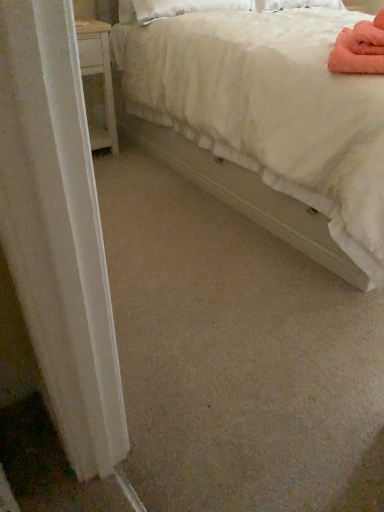
Question: From the image's perspective, is pink fluffy bath towel at upper right over white fluffy bed at upper right?

Choices:
 (A) yes
 (B) no

Answer: (B)

Question: Is pink fluffy bath towel at upper right shorter than white fluffy bed at upper right?

Choices:
 (A) no
 (B) yes

Answer: (B)

Question: Is pink fluffy bath towel at upper right oriented away from white fluffy bed at upper right?

Choices:
 (A) yes
 (B) no

Answer: (A)

Question: Is pink fluffy bath towel at upper right far away from white fluffy bed at upper right?

Choices:
 (A) no
 (B) yes

Answer: (A)

Question: Can you confirm if pink fluffy bath towel at upper right is taller than white fluffy bed at upper right?

Choices:
 (A) no
 (B) yes

Answer: (A)

Question: Is pink fluffy bath towel at upper right positioned beyond the bounds of white fluffy bed at upper right?

Choices:
 (A) no
 (B) yes

Answer: (A)

Question: From the image's perspective, would you say white fluffy bed at upper right is shown under pink fluffy bath towel at upper right?

Choices:
 (A) no
 (B) yes

Answer: (A)

Question: Does white fluffy bed at upper right have a larger size compared to pink fluffy bath towel at upper right?

Choices:
 (A) yes
 (B) no

Answer: (A)

Question: Is white fluffy bed at upper right smaller than pink fluffy bath towel at upper right?

Choices:
 (A) no
 (B) yes

Answer: (A)

Question: From a real-world perspective, is white fluffy bed at upper right on top of pink fluffy bath towel at upper right?

Choices:
 (A) yes
 (B) no

Answer: (B)

Question: Is white fluffy bed at upper right taller than pink fluffy bath towel at upper right?

Choices:
 (A) no
 (B) yes

Answer: (B)

Question: Is white fluffy bed at upper right next to pink fluffy bath towel at upper right and touching it?

Choices:
 (A) yes
 (B) no

Answer: (B)

Question: From a real-world perspective, relative to white fluffy bed at upper right, is pink fluffy bath towel at upper right vertically above or below?

Choices:
 (A) below
 (B) above

Answer: (B)